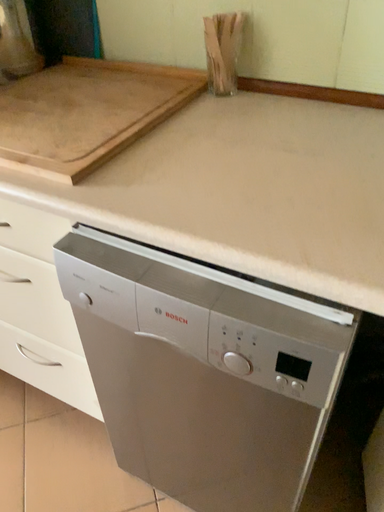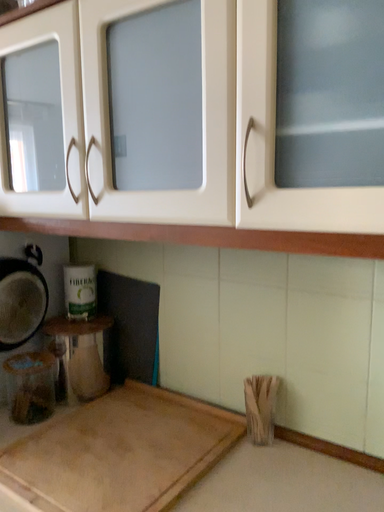
Question: Which way did the camera rotate in the video?

Choices:
 (A) rotated downward
 (B) rotated upward

Answer: (B)